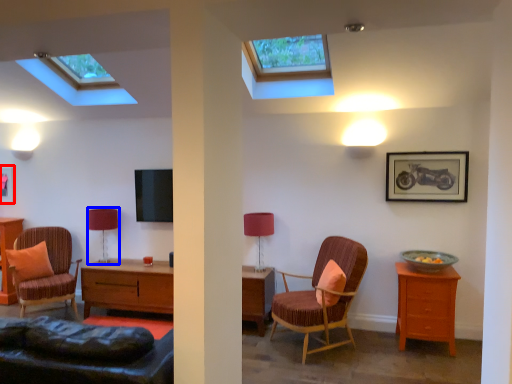
Question: Which object appears closest to the camera in this image, picture frame (highlighted by a red box) or table lamp (highlighted by a blue box)?

Choices:
 (A) picture frame
 (B) table lamp

Answer: (B)